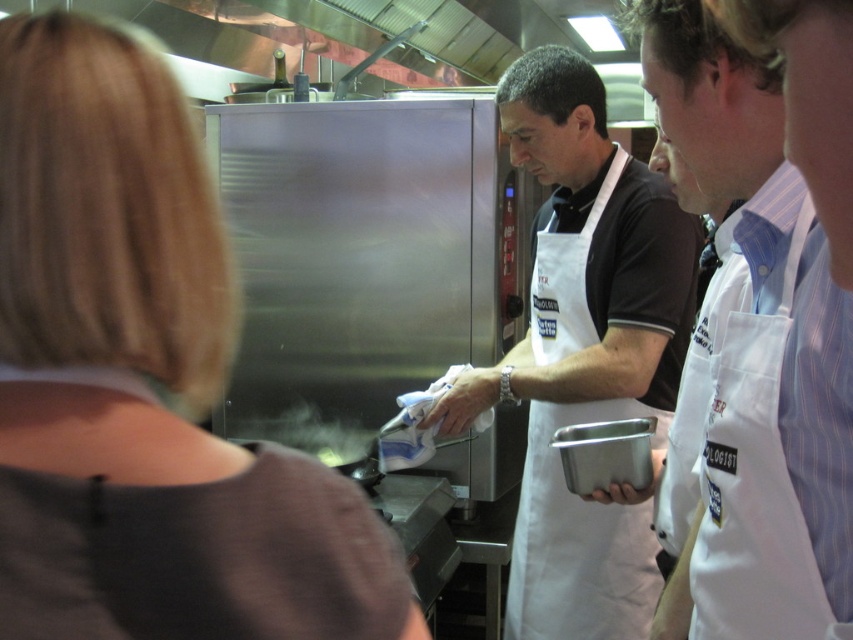
Is brown matte shirt at upper left to the left of white apron at right from the viewer's perspective?

Yes, brown matte shirt at upper left is to the left of white apron at right.

What are the coordinates of `brown matte shirt at upper left` in the screenshot? It's located at (180, 529).

Can you confirm if brown matte shirt at upper left is positioned to the left of white fabric apron at center?

Yes, brown matte shirt at upper left is to the left of white fabric apron at center.

Does brown matte shirt at upper left have a lesser width compared to white fabric apron at center?

Yes.

Where is `brown matte shirt at upper left`? Image resolution: width=853 pixels, height=640 pixels. brown matte shirt at upper left is located at coordinates (180, 529).

Between white apron at right and white fabric apron at center, which one has less height?

With less height is white apron at right.

Does white apron at right appear over white fabric apron at center?

Yes.

Describe the element at coordinates (761, 353) in the screenshot. The image size is (853, 640). I see `white apron at right` at that location.

Locate an element on the screen. This screenshot has height=640, width=853. white apron at right is located at coordinates (761, 353).